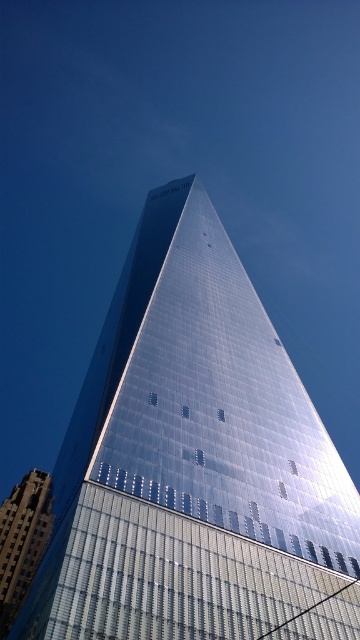
Does point (169, 307) come closer to viewer compared to point (27, 502)?

That is True.

The image size is (360, 640). Describe the element at coordinates (194, 461) in the screenshot. I see `shiny glass skyscraper at center` at that location.

You are a GUI agent. You are given a task and a screenshot of the screen. Output one action in this format:
    pyautogui.click(x=<x>, y=<y>)
    Task: Click on the shiny glass skyscraper at center
    
    Given the screenshot: What is the action you would take?
    pyautogui.click(x=194, y=461)